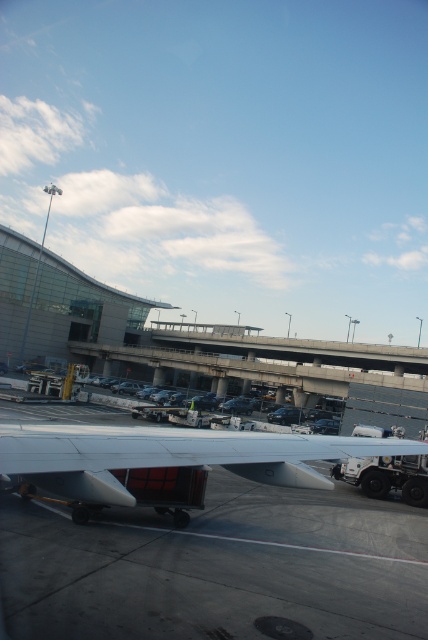
Is gray concrete tarmac at lower center to the right of silver metallic wing at center from the viewer's perspective?

Indeed, gray concrete tarmac at lower center is positioned on the right side of silver metallic wing at center.

Who is more forward, (329, 561) or (62, 467)?

Positioned in front is point (62, 467).

Is point (299, 598) less distant than point (125, 504)?

No.

Where is `gray concrete tarmac at lower center`? Image resolution: width=428 pixels, height=640 pixels. gray concrete tarmac at lower center is located at coordinates (217, 566).